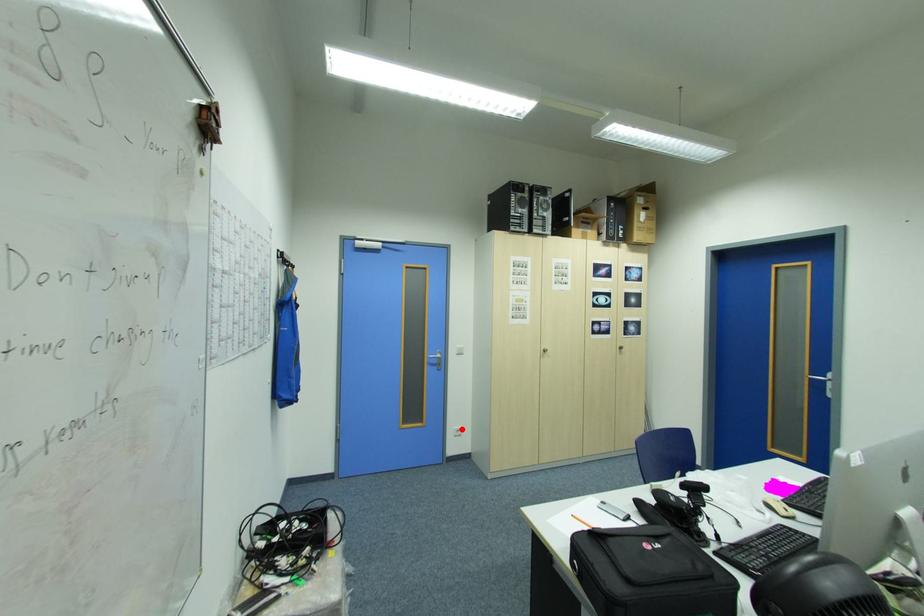
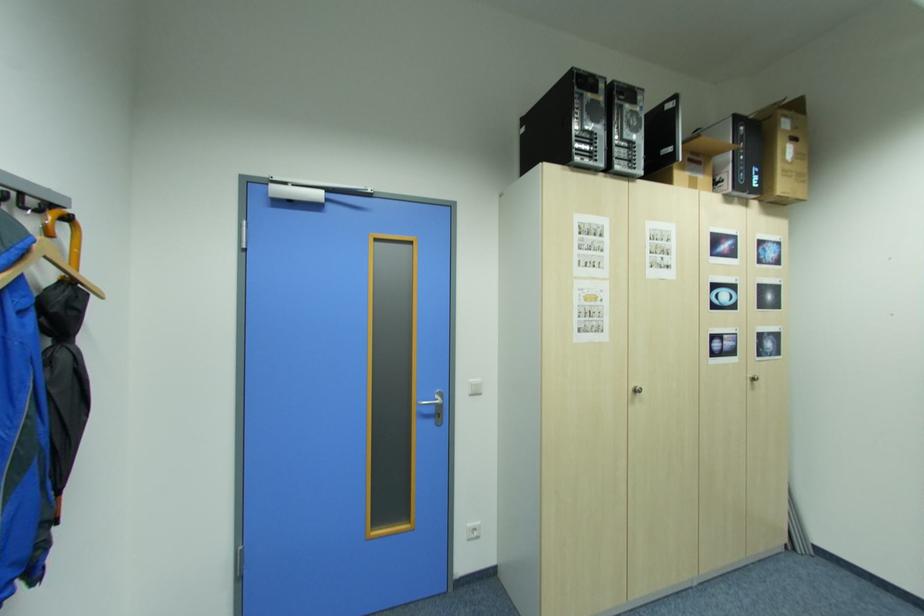
Question: I am providing you with two images of the same scene from different viewpoints. A red point is shown in image1. For the corresponding object point in image2, is it positioned nearer or farther from the camera?

Choices:
 (A) Nearer
 (B) Farther

Answer: (A)